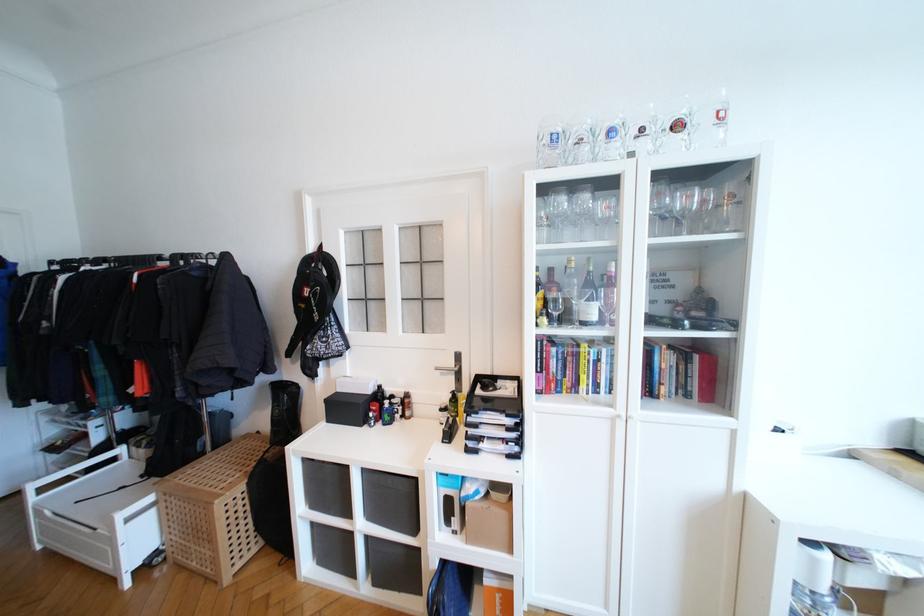
The width and height of the screenshot is (924, 616). What are the coordinates of `silver door handle` in the screenshot? It's located at (453, 373).